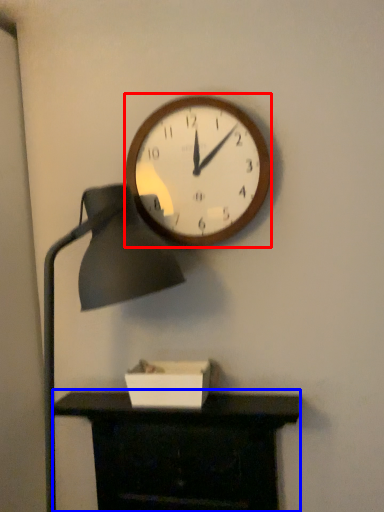
Question: Among these objects, which one is nearest to the camera, wall clock (highlighted by a red box) or furniture (highlighted by a blue box)?

Choices:
 (A) wall clock
 (B) furniture

Answer: (B)